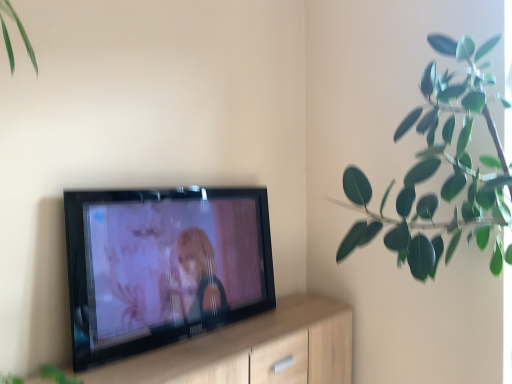
Question: From a real-world perspective, is green rubber plant at upper right above or below light wood dresser at center?

Choices:
 (A) above
 (B) below

Answer: (A)

Question: Does point tap(464, 69) appear closer or farther from the camera than point tap(233, 326)?

Choices:
 (A) farther
 (B) closer

Answer: (B)

Question: In the image, is green rubber plant at upper right positioned in front of or behind light wood dresser at center?

Choices:
 (A) front
 (B) behind

Answer: (B)

Question: Considering the relative positions of light wood dresser at center and green rubber plant at upper right in the image provided, is light wood dresser at center to the left or to the right of green rubber plant at upper right?

Choices:
 (A) right
 (B) left

Answer: (B)

Question: From a real-world perspective, is light wood dresser at center above or below green rubber plant at upper right?

Choices:
 (A) above
 (B) below

Answer: (B)

Question: Considering their positions, is light wood dresser at center located in front of or behind green rubber plant at upper right?

Choices:
 (A) front
 (B) behind

Answer: (A)

Question: Is point (225, 344) positioned closer to the camera than point (483, 48)?

Choices:
 (A) closer
 (B) farther

Answer: (A)